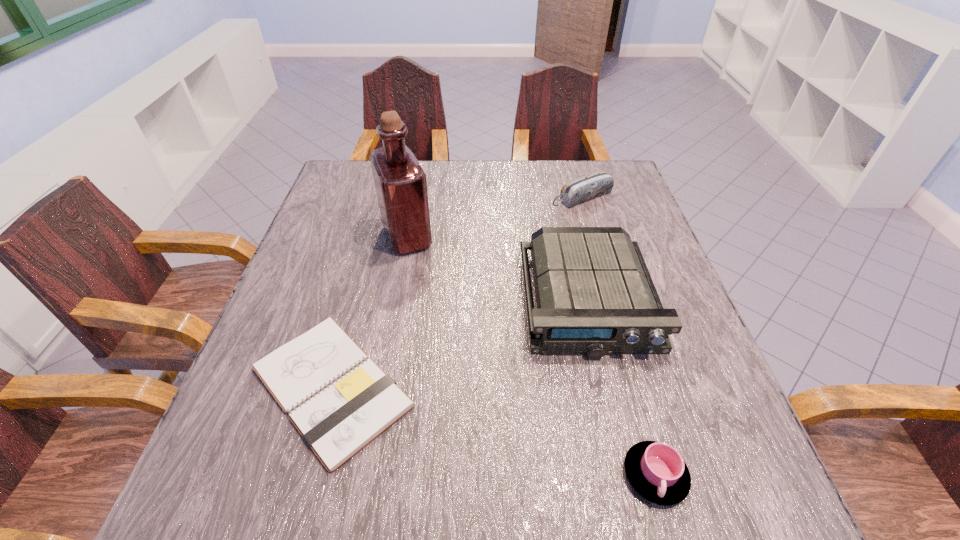
You are a GUI agent. You are given a task and a screenshot of the screen. Output one action in this format:
    pyautogui.click(x=<x>, y=<y>)
    Task: Click on the object at the far edge
    Image resolution: width=960 pixels, height=540 pixels.
    Given the screenshot: What is the action you would take?
    pyautogui.click(x=591, y=186)

The height and width of the screenshot is (540, 960). What are the coordinates of `cup that is at the near edge` in the screenshot? It's located at (656, 470).

Locate an element on the screen. notepad that is at the near edge is located at coordinates click(339, 400).

Identify the location of object present at the left edge. This screenshot has width=960, height=540. (339, 400).

You are a GUI agent. You are given a task and a screenshot of the screen. Output one action in this format:
    pyautogui.click(x=<x>, y=<y>)
    Task: Click on the radio receiver that is at the right edge
    The width and height of the screenshot is (960, 540).
    Given the screenshot: What is the action you would take?
    pyautogui.click(x=595, y=296)

Identify the location of pencil box that is at the right edge. (591, 186).

This screenshot has height=540, width=960. In order to click on cup present at the right edge in this screenshot , I will do `click(656, 470)`.

Image resolution: width=960 pixels, height=540 pixels. In order to click on object located at the near left corner in this screenshot , I will do `click(339, 400)`.

Where is `object that is positioned at the far right corner`? The width and height of the screenshot is (960, 540). object that is positioned at the far right corner is located at coordinates (591, 186).

This screenshot has height=540, width=960. Identify the location of object positioned at the near right corner. (656, 470).